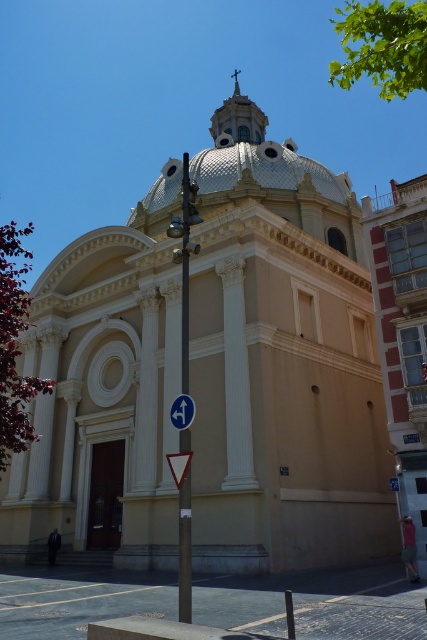
Question: Does metallic pole at center have a lesser width compared to white plastic arrow at center?

Choices:
 (A) yes
 (B) no

Answer: (B)

Question: Which point is farther to the camera?

Choices:
 (A) (186, 396)
 (B) (184, 336)
 (C) (183, 472)

Answer: (B)

Question: Which point is closer to the camera?

Choices:
 (A) white plastic arrow at center
 (B) white plastic triangle at center
 (C) metallic pole at center

Answer: (C)

Question: Among these points, which one is nearest to the camera?

Choices:
 (A) (172, 468)
 (B) (193, 406)

Answer: (A)

Question: Is metallic pole at center bigger than white plastic arrow at center?

Choices:
 (A) yes
 (B) no

Answer: (A)

Question: Is metallic pole at center to the right of white plastic triangle at center from the viewer's perspective?

Choices:
 (A) yes
 (B) no

Answer: (B)